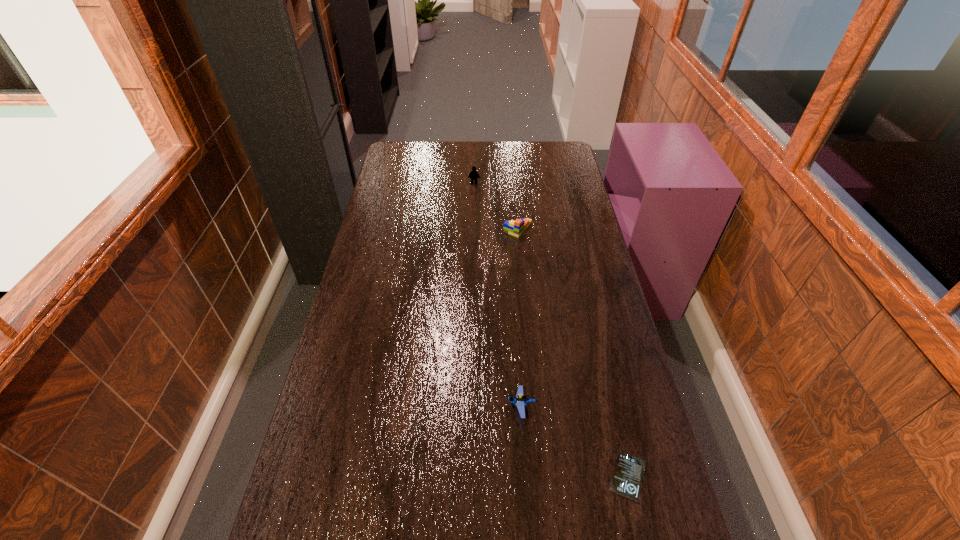
Find the location of a particular element. free space in the image that satisfies the following two spatial constraints: 1. on the front-facing side of the nearest object; 2. on the right side of the shortest Lego is located at coordinates (525, 477).